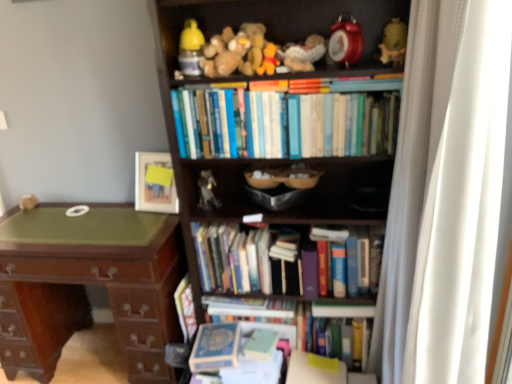
Question: Is fuzzy fabric stuffed animal at upper center, arranged as the fifth toy when viewed from the right, surrounding matte yellow ceramic vase at upper right, positioned as the ninth toy in left-to-right order?

Choices:
 (A) yes
 (B) no

Answer: (B)

Question: Is fuzzy fabric stuffed animal at upper center, arranged as the fifth toy when viewed from the right, positioned beyond the bounds of matte yellow ceramic vase at upper right, the first toy when ordered from right to left?

Choices:
 (A) yes
 (B) no

Answer: (A)

Question: Can you confirm if fuzzy fabric stuffed animal at upper center, the 5th toy positioned from the left, is smaller than matte yellow ceramic vase at upper right, the first toy when ordered from right to left?

Choices:
 (A) no
 (B) yes

Answer: (A)

Question: Are fuzzy fabric stuffed animal at upper center, the 5th toy positioned from the left, and matte yellow ceramic vase at upper right, positioned as the ninth toy in left-to-right order, far apart?

Choices:
 (A) yes
 (B) no

Answer: (B)

Question: Can you confirm if fuzzy fabric stuffed animal at upper center, the 5th toy positioned from the left, is thinner than matte yellow ceramic vase at upper right, the first toy when ordered from right to left?

Choices:
 (A) yes
 (B) no

Answer: (B)

Question: Is metallic silver figurine at center, arranged as the 3th toy when viewed from the left, bigger or smaller than hardcover books at center, the 4th book when ordered from bottom to top?

Choices:
 (A) big
 (B) small

Answer: (B)

Question: Considering their positions, is metallic silver figurine at center, arranged as the 3th toy when viewed from the left, located in front of or behind hardcover books at center, the 4th book when ordered from bottom to top?

Choices:
 (A) behind
 (B) front

Answer: (A)

Question: Is metallic silver figurine at center, arranged as the 3th toy when viewed from the left, taller or shorter than hardcover books at center, the 4th book when ordered from bottom to top?

Choices:
 (A) tall
 (B) short

Answer: (B)

Question: Which is correct: metallic silver figurine at center, the seventh toy positioned from the right, is inside hardcover books at center, the 2th book viewed from the top, or outside of it?

Choices:
 (A) outside
 (B) inside

Answer: (A)

Question: From a real-world perspective, is metallic silver figurine at center, arranged as the 3th toy when viewed from the left, physically located above or below brown plush bear at upper center, the 6th toy positioned from the right?

Choices:
 (A) above
 (B) below

Answer: (B)

Question: From the image's perspective, is metallic silver figurine at center, arranged as the 3th toy when viewed from the left, positioned above or below brown plush bear at upper center, the 6th toy positioned from the right?

Choices:
 (A) below
 (B) above

Answer: (A)

Question: Is metallic silver figurine at center, arranged as the 3th toy when viewed from the left, bigger or smaller than brown plush bear at upper center, the fourth toy in the left-to-right sequence?

Choices:
 (A) small
 (B) big

Answer: (A)

Question: In terms of width, does metallic silver figurine at center, arranged as the 3th toy when viewed from the left, look wider or thinner when compared to brown plush bear at upper center, the 6th toy positioned from the right?

Choices:
 (A) thin
 (B) wide

Answer: (A)

Question: From their relative heights in the image, would you say matte wooden picture frame at upper center is taller or shorter than white plush toy at left, the 1th toy when ordered from left to right?

Choices:
 (A) tall
 (B) short

Answer: (A)

Question: Would you say matte wooden picture frame at upper center is inside or outside white plush toy at left, the ninth toy from the right?

Choices:
 (A) outside
 (B) inside

Answer: (A)